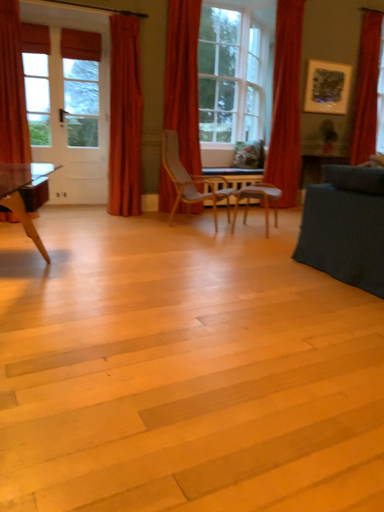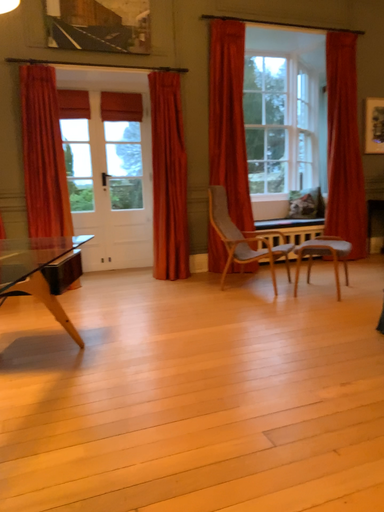
Question: How did the camera likely rotate when shooting the video?

Choices:
 (A) rotated left
 (B) rotated right

Answer: (A)